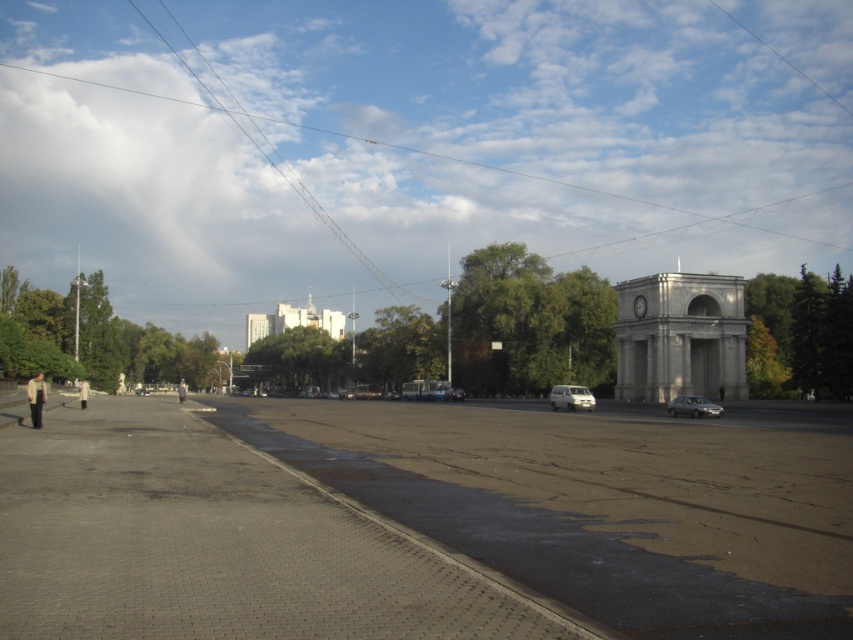
From the picture: Is green leafy tree at left above light gray fabric person at center?

Correct, green leafy tree at left is located above light gray fabric person at center.

Measure the distance between point [22,358] and camera.

Point [22,358] is 203.12 feet from camera.

Where is `green leafy tree at left`? green leafy tree at left is located at coordinates (97, 340).

Who is shorter, light beige jacket at lower left or light gray fabric person at center?

With less height is light beige jacket at lower left.

Does light beige jacket at lower left have a lesser width compared to light gray fabric person at center?

Indeed, light beige jacket at lower left has a lesser width compared to light gray fabric person at center.

Is point (39, 408) positioned after point (178, 385)?

That is False.

Image resolution: width=853 pixels, height=640 pixels. Find the location of `light beige jacket at lower left`. light beige jacket at lower left is located at coordinates (36, 397).

Can you confirm if gray concrete pavement at lower left is bigger than light gray fabric person at center?

No.

From the picture: Is gray concrete pavement at lower left wider than light gray fabric person at center?

No, gray concrete pavement at lower left is not wider than light gray fabric person at center.

Locate an element on the screen. The height and width of the screenshot is (640, 853). gray concrete pavement at lower left is located at coordinates (601, 502).

Where is `gray concrete pavement at lower left`? The height and width of the screenshot is (640, 853). gray concrete pavement at lower left is located at coordinates (601, 502).